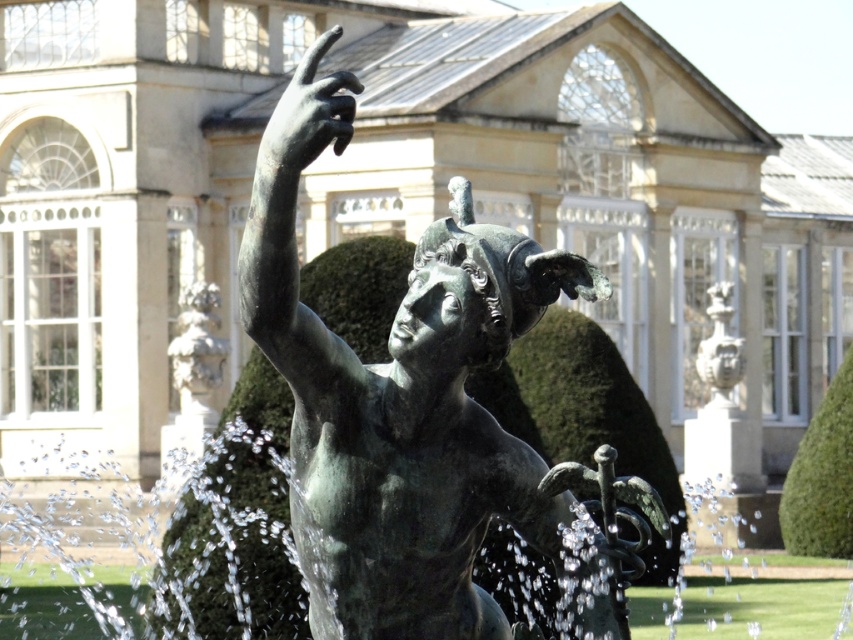
Question: Which of the following is the closest to the observer?

Choices:
 (A) polished bronze mask at upper right
 (B) bronze statue at center
 (C) bronze hand at upper center

Answer: (B)

Question: Does bronze hand at upper center have a larger size compared to smooth white stone cherub at left?

Choices:
 (A) yes
 (B) no

Answer: (A)

Question: Is bronze statue at center below bronze hand at upper center?

Choices:
 (A) no
 (B) yes

Answer: (B)

Question: Is bronze hand at upper center wider than smooth white stone cherub at left?

Choices:
 (A) no
 (B) yes

Answer: (B)

Question: Which object is the closest to the smooth white stone cherub at left?

Choices:
 (A) bronze hand at upper center
 (B) bronze statue at center

Answer: (A)

Question: Among these objects, which one is farthest from the camera?

Choices:
 (A) smooth white stone cherub at left
 (B) bronze hand at upper center
 (C) polished bronze mask at upper right

Answer: (C)